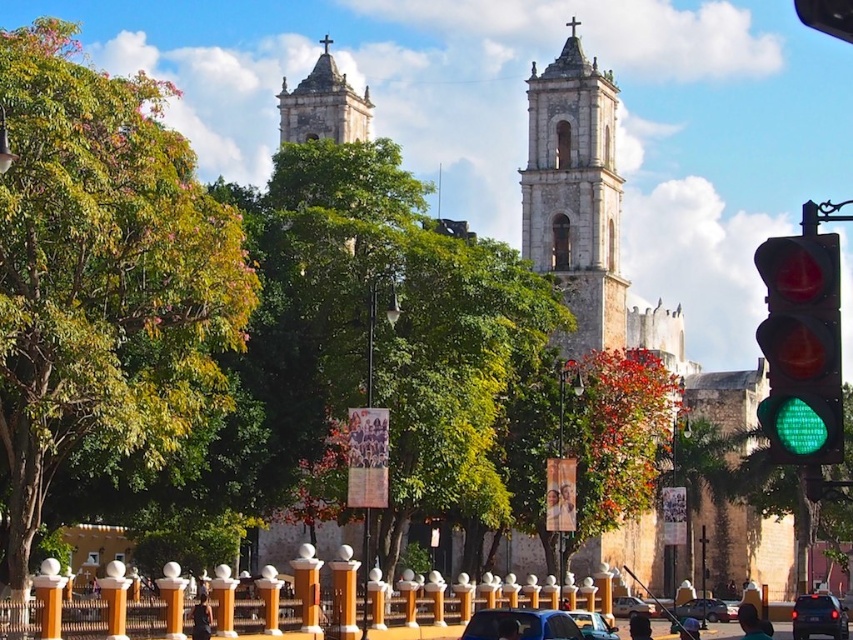
You are standing in the street scene looking at the church. There are two points marked on the image. The first point is at coordinates point (479,634) and the second point is at point (724,618). Which point is closer to you?

Point (479,634) is closer to the camera than point (724,618).

You are a tourist standing on the sidewalk and want to take a photo of the white stone tower at upper center without the green glass traffic light at right blocking it. Which direction should you move to achieve this?

The green glass traffic light at right is smaller than the white stone tower at upper center, so moving to the left would allow you to position yourself where the traffic light no longer blocks the view of the tower.